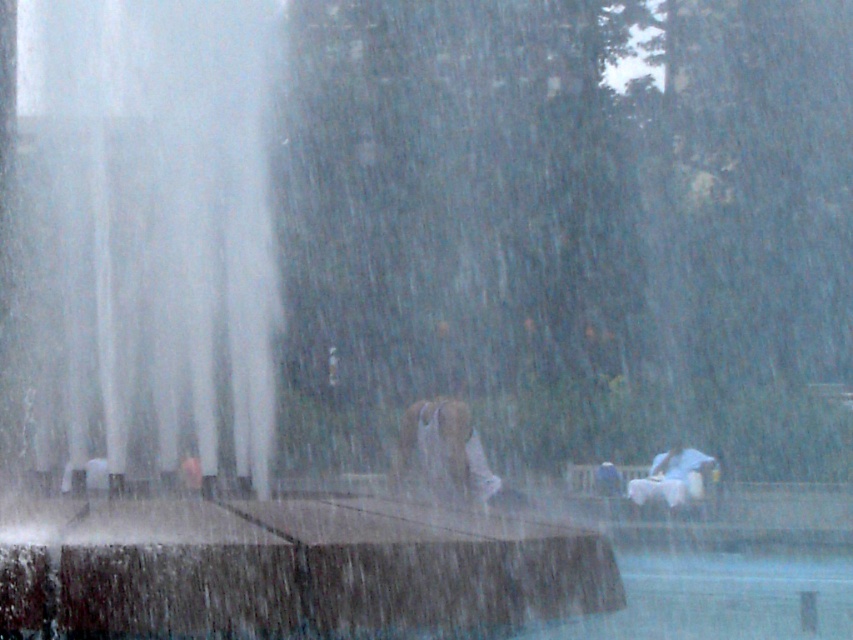
You are a visitor at the park and see the transparent glass fountain at center and the white matte horse at lower right. Which object is closer to the left side of the park?

The transparent glass fountain at center is closer to the left side of the park because it is positioned to the left of the white matte horse at lower right.

You are a visitor at the park and want to take a photo of both the transparent glass fountain at center and the white matte horse at lower right. Which object should you focus on first to ensure both are in the frame?

You should focus on the transparent glass fountain at center first because it is closer to you than the white matte horse at lower right, so adjusting the camera to include both would require starting with the closer object.